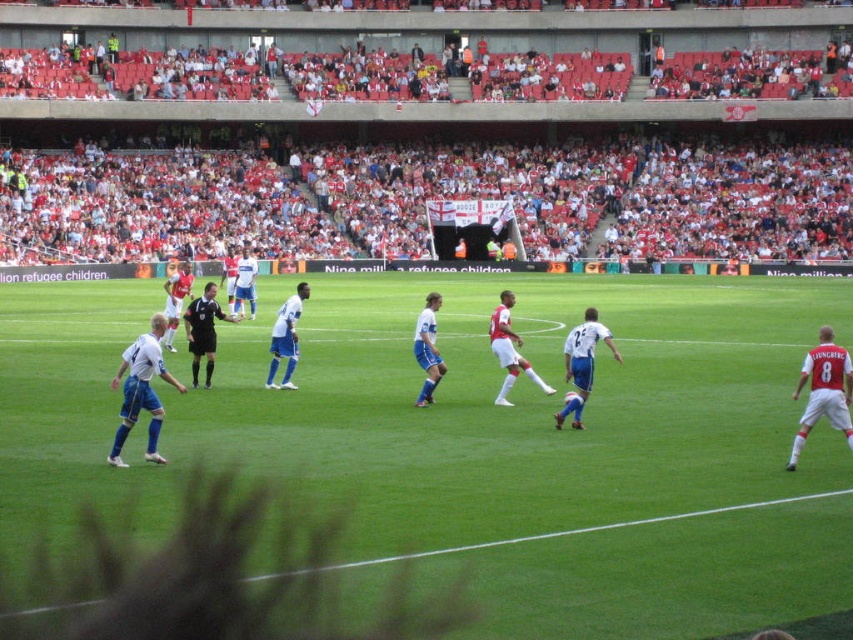
You are a soccer coach observing the match. You notice the white smooth soccer player at left and the blue jersey at center. Which player is positioned more to the left side of the field?

The white smooth soccer player at left is positioned more to the left side of the field than the blue jersey at center.

You are a photographer positioned at the edge of the soccer field. You notice the white jersey at right and the black uniform at center. Which of these two has a taller silhouette when viewed from your position?

The white jersey at right has a greater height compared to the black uniform at center, so the white jersey at right has a taller silhouette.